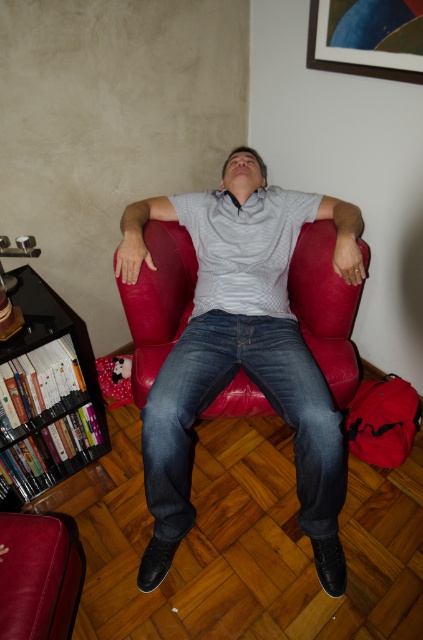
Is leather couch at center to the right of wooden bookshelf at lower left from the viewer's perspective?

Correct, you'll find leather couch at center to the right of wooden bookshelf at lower left.

Is leather couch at center taller than wooden bookshelf at lower left?

Incorrect, leather couch at center's height is not larger of wooden bookshelf at lower left's.

Who is more distant from viewer, (151, 368) or (5, 438)?

The point (151, 368) is behind.

Where is `leather couch at center`? Image resolution: width=423 pixels, height=640 pixels. leather couch at center is located at coordinates (159, 301).

Between leather armchair at lower left and metallic gold picture frame at upper right, which one appears on the right side from the viewer's perspective?

metallic gold picture frame at upper right

Between leather armchair at lower left and metallic gold picture frame at upper right, which one appears on the left side from the viewer's perspective?

leather armchair at lower left

You are a GUI agent. You are given a task and a screenshot of the screen. Output one action in this format:
    pyautogui.click(x=<x>, y=<y>)
    Task: Click on the leather armchair at lower left
    Image resolution: width=423 pixels, height=640 pixels.
    Given the screenshot: What is the action you would take?
    [36, 577]

In the scene shown: Is denim jeans at center wider than leather couch at center?

No, denim jeans at center is not wider than leather couch at center.

Does denim jeans at center have a lesser width compared to leather couch at center?

Yes, denim jeans at center is thinner than leather couch at center.

Does point (164, 384) come farther from viewer compared to point (302, 273)?

No, it is in front of (302, 273).

Locate an element on the screen. The height and width of the screenshot is (640, 423). denim jeans at center is located at coordinates 266,397.